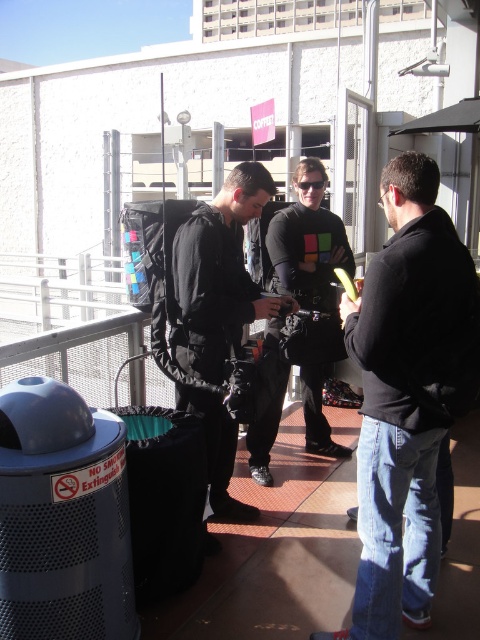
Question: Does black matte jacket at right appear over black matte shirt at center?

Choices:
 (A) no
 (B) yes

Answer: (A)

Question: Estimate the real-world distances between objects in this image. Which object is closer to the black matte shirt at center?

Choices:
 (A) black matte jacket at center
 (B) black matte jacket at right

Answer: (A)

Question: Considering the relative positions of black matte jacket at center and black matte shirt at center in the image provided, where is black matte jacket at center located with respect to black matte shirt at center?

Choices:
 (A) left
 (B) right

Answer: (A)

Question: Which object is farther from the camera taking this photo?

Choices:
 (A) black matte jacket at right
 (B) black matte shirt at center

Answer: (B)

Question: Observing the image, what is the correct spatial positioning of black matte jacket at right in reference to black matte shirt at center?

Choices:
 (A) right
 (B) left

Answer: (A)

Question: Among these objects, which one is farthest from the camera?

Choices:
 (A) black matte jacket at right
 (B) black matte shirt at center

Answer: (B)